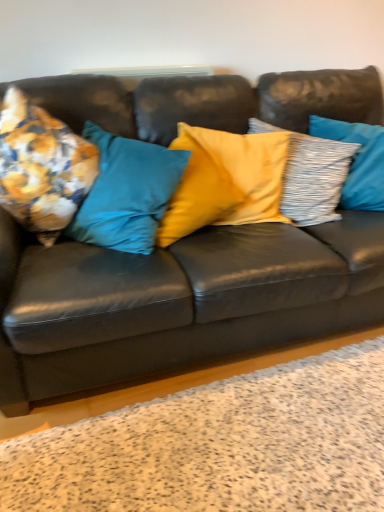
Describe the element at coordinates (357, 161) in the screenshot. I see `textured gray pillow at right, marked as the first pillow in a right-to-left arrangement` at that location.

Image resolution: width=384 pixels, height=512 pixels. Describe the element at coordinates (42, 167) in the screenshot. I see `floral fabric cushion at left, which is counted as the first pillow, starting from the left` at that location.

In order to face yellow satin pillow at center, the second pillow positioned from the right, should I rotate leftwards or rightwards?

Rotate your view right by about 14.690°.

Find the location of a particular element. This screenshot has width=384, height=512. floral fabric cushion at left, the 3th pillow positioned from the right is located at coordinates (126, 192).

Where is `matte black couch at center`? The image size is (384, 512). matte black couch at center is located at coordinates (176, 301).

Locate an element on the screen. This screenshot has width=384, height=512. textured gray pillow at right, the fourth pillow positioned from the left is located at coordinates (357, 161).

Considering the sizes of yellow satin pillow at center, arranged as the 3th pillow when viewed from the left, and floral fabric cushion at left, the 2th pillow from the left, in the image, is yellow satin pillow at center, arranged as the 3th pillow when viewed from the left, taller or shorter than floral fabric cushion at left, the 2th pillow from the left,?

In the image, yellow satin pillow at center, arranged as the 3th pillow when viewed from the left, appears to be taller than floral fabric cushion at left, the 2th pillow from the left.

Is floral fabric cushion at left, the 2th pillow from the left, a part of yellow satin pillow at center, the second pillow positioned from the right?

No, yellow satin pillow at center, the second pillow positioned from the right, does not contain floral fabric cushion at left, the 2th pillow from the left.

What's the angular difference between yellow satin pillow at center, arranged as the 3th pillow when viewed from the left, and floral fabric cushion at left, the 3th pillow positioned from the right,'s facing directions?

10.3 degrees separate the facing orientations of yellow satin pillow at center, arranged as the 3th pillow when viewed from the left, and floral fabric cushion at left, the 3th pillow positioned from the right.

Is yellow satin pillow at center, the second pillow positioned from the right, in contact with floral fabric cushion at left, the 2th pillow from the left?

yellow satin pillow at center, the second pillow positioned from the right, and floral fabric cushion at left, the 2th pillow from the left, are clearly separated.

From a real-world perspective, is matte black couch at center physically above floral fabric cushion at left, the 2th pillow from the left?

No, from a real-world perspective, matte black couch at center is not over floral fabric cushion at left, the 2th pillow from the left

Could you measure the distance between matte black couch at center and floral fabric cushion at left, the 2th pillow from the left?

matte black couch at center and floral fabric cushion at left, the 2th pillow from the left, are 12.08 inches apart from each other.

In the scene shown: Does matte black couch at center touch floral fabric cushion at left, the 2th pillow from the left?

No, matte black couch at center is not with floral fabric cushion at left, the 2th pillow from the left.

Is matte black couch at center to the left of floral fabric cushion at left, the 3th pillow positioned from the right, from the viewer's perspective?

Incorrect, matte black couch at center is not on the left side of floral fabric cushion at left, the 3th pillow positioned from the right.

Could you measure the distance between textured gray pillow at right, marked as the first pillow in a right-to-left arrangement, and yellow satin pillow at center, arranged as the 3th pillow when viewed from the left?

10.09 centimeters.

Is textured gray pillow at right, marked as the first pillow in a right-to-left arrangement, smaller than yellow satin pillow at center, the second pillow positioned from the right?

Indeed, textured gray pillow at right, marked as the first pillow in a right-to-left arrangement, has a smaller size compared to yellow satin pillow at center, the second pillow positioned from the right.

Identify the location of pillow above the yellow satin pillow at center, arranged as the 3th pillow when viewed from the left (from the image's perspective). The width and height of the screenshot is (384, 512). (357, 161).

Is textured gray pillow at right, marked as the first pillow in a right-to-left arrangement, oriented away from yellow satin pillow at center, the second pillow positioned from the right?

Correct, textured gray pillow at right, marked as the first pillow in a right-to-left arrangement, is looking away from yellow satin pillow at center, the second pillow positioned from the right.

Which of these two, floral fabric cushion at left, which is counted as the first pillow, starting from the left, or yellow satin pillow at center, the second pillow positioned from the right, is smaller?

Smaller between the two is floral fabric cushion at left, which is counted as the first pillow, starting from the left.

Could you measure the distance between floral fabric cushion at left, which is counted as the first pillow, starting from the left, and yellow satin pillow at center, arranged as the 3th pillow when viewed from the left?

floral fabric cushion at left, which is counted as the first pillow, starting from the left, and yellow satin pillow at center, arranged as the 3th pillow when viewed from the left, are 34.55 inches apart from each other.

Which is in front, floral fabric cushion at left, which ranks as the 4th pillow in right-to-left order, or yellow satin pillow at center, the second pillow positioned from the right?

floral fabric cushion at left, which ranks as the 4th pillow in right-to-left order.

Based on the photo, between floral fabric cushion at left, which is counted as the first pillow, starting from the left, and yellow satin pillow at center, arranged as the 3th pillow when viewed from the left, which one has more height?

yellow satin pillow at center, arranged as the 3th pillow when viewed from the left, is taller.

From a real-world perspective, which pillow is the 2nd one above the matte black couch at center? Please provide its 2D coordinates.

[(357, 161)]

What's the angular difference between matte black couch at center and textured gray pillow at right, the fourth pillow positioned from the left,'s facing directions?

21.3 degrees.

Based on the photo, from a real-world perspective, is matte black couch at center located beneath textured gray pillow at right, marked as the first pillow in a right-to-left arrangement?

Yes, from a real-world perspective, matte black couch at center is under textured gray pillow at right, marked as the first pillow in a right-to-left arrangement.

From the image's perspective, which object appears higher, matte black couch at center or textured gray pillow at right, marked as the first pillow in a right-to-left arrangement?

From the image's view, textured gray pillow at right, marked as the first pillow in a right-to-left arrangement, is above.

Is textured gray pillow at right, the fourth pillow positioned from the left, completely or partially outside of floral fabric cushion at left, which is counted as the first pillow, starting from the left?

Yes, textured gray pillow at right, the fourth pillow positioned from the left, is outside of floral fabric cushion at left, which is counted as the first pillow, starting from the left.

Between textured gray pillow at right, marked as the first pillow in a right-to-left arrangement, and floral fabric cushion at left, which ranks as the 4th pillow in right-to-left order, which one has smaller width?

textured gray pillow at right, marked as the first pillow in a right-to-left arrangement.

Looking at this image, is textured gray pillow at right, the fourth pillow positioned from the left, facing away from floral fabric cushion at left, which ranks as the 4th pillow in right-to-left order?

No, textured gray pillow at right, the fourth pillow positioned from the left, is not facing the opposite direction of floral fabric cushion at left, which ranks as the 4th pillow in right-to-left order.

Which of these two, floral fabric cushion at left, which is counted as the first pillow, starting from the left, or textured gray pillow at right, marked as the first pillow in a right-to-left arrangement, is smaller?

floral fabric cushion at left, which is counted as the first pillow, starting from the left.

Who is taller, floral fabric cushion at left, which is counted as the first pillow, starting from the left, or textured gray pillow at right, the fourth pillow positioned from the left?

textured gray pillow at right, the fourth pillow positioned from the left, is taller.

Looking at this image, is there a large distance between floral fabric cushion at left, which is counted as the first pillow, starting from the left, and textured gray pillow at right, the fourth pillow positioned from the left?

Yes, floral fabric cushion at left, which is counted as the first pillow, starting from the left, and textured gray pillow at right, the fourth pillow positioned from the left, are located far from each other.

Is floral fabric cushion at left, which ranks as the 4th pillow in right-to-left order, wider or thinner than textured gray pillow at right, marked as the first pillow in a right-to-left arrangement?

In the image, floral fabric cushion at left, which ranks as the 4th pillow in right-to-left order, appears to be wider than textured gray pillow at right, marked as the first pillow in a right-to-left arrangement.

Identify the location of pillow that is the 1st object located behind the floral fabric cushion at left, the 2th pillow from the left. This screenshot has height=512, width=384. (311, 175).

I want to click on the 1st pillow to the left when counting from the matte black couch at center, so click(x=126, y=192).

When comparing their distances from textured gray pillow at right, marked as the first pillow in a right-to-left arrangement, does matte black couch at center or yellow satin pillow at center, the second pillow positioned from the right, seem further?

The object further to textured gray pillow at right, marked as the first pillow in a right-to-left arrangement, is matte black couch at center.

Looking at the image, which one is located closer to floral fabric cushion at left, which is counted as the first pillow, starting from the left, matte black couch at center or yellow satin pillow at center, arranged as the 3th pillow when viewed from the left?

The object closer to floral fabric cushion at left, which is counted as the first pillow, starting from the left, is matte black couch at center.

Which object lies further to the anchor point floral fabric cushion at left, the 2th pillow from the left, yellow satin pillow at center, the second pillow positioned from the right, or floral fabric cushion at left, which is counted as the first pillow, starting from the left?

Among the two, yellow satin pillow at center, the second pillow positioned from the right, is located further to floral fabric cushion at left, the 2th pillow from the left.

Considering their positions, is matte black couch at center positioned closer to floral fabric cushion at left, the 2th pillow from the left, than floral fabric cushion at left, which is counted as the first pillow, starting from the left?

Based on the image, floral fabric cushion at left, which is counted as the first pillow, starting from the left, appears to be nearer to floral fabric cushion at left, the 2th pillow from the left.

Looking at the image, which one is located closer to floral fabric cushion at left, the 2th pillow from the left, textured gray pillow at right, marked as the first pillow in a right-to-left arrangement, or matte black couch at center?

matte black couch at center.

From the image, which object appears to be farther from floral fabric cushion at left, the 2th pillow from the left, textured gray pillow at right, the fourth pillow positioned from the left, or yellow satin pillow at center, arranged as the 3th pillow when viewed from the left?

The object further to floral fabric cushion at left, the 2th pillow from the left, is textured gray pillow at right, the fourth pillow positioned from the left.

Based on their spatial positions, is floral fabric cushion at left, which is counted as the first pillow, starting from the left, or yellow satin pillow at center, arranged as the 3th pillow when viewed from the left, closer to textured gray pillow at right, the fourth pillow positioned from the left?

yellow satin pillow at center, arranged as the 3th pillow when viewed from the left, lies closer to textured gray pillow at right, the fourth pillow positioned from the left, than the other object.

Looking at the image, which one is located further to textured gray pillow at right, marked as the first pillow in a right-to-left arrangement, floral fabric cushion at left, the 3th pillow positioned from the right, or matte black couch at center?

Based on the image, floral fabric cushion at left, the 3th pillow positioned from the right, appears to be further to textured gray pillow at right, marked as the first pillow in a right-to-left arrangement.

I want to click on pillow between floral fabric cushion at left, the 3th pillow positioned from the right, and textured gray pillow at right, marked as the first pillow in a right-to-left arrangement, in the horizontal direction, so click(311, 175).

What are the coordinates of `studio couch situated between floral fabric cushion at left, the 2th pillow from the left, and textured gray pillow at right, the fourth pillow positioned from the left, from left to right` in the screenshot? It's located at (176, 301).

Identify the location of pillow between floral fabric cushion at left, which ranks as the 4th pillow in right-to-left order, and yellow satin pillow at center, the second pillow positioned from the right, in the horizontal direction. This screenshot has width=384, height=512. (126, 192).

Locate an element on the screen. The height and width of the screenshot is (512, 384). studio couch located between floral fabric cushion at left, the 2th pillow from the left, and yellow satin pillow at center, arranged as the 3th pillow when viewed from the left, in the left-right direction is located at coordinates pyautogui.click(x=176, y=301).